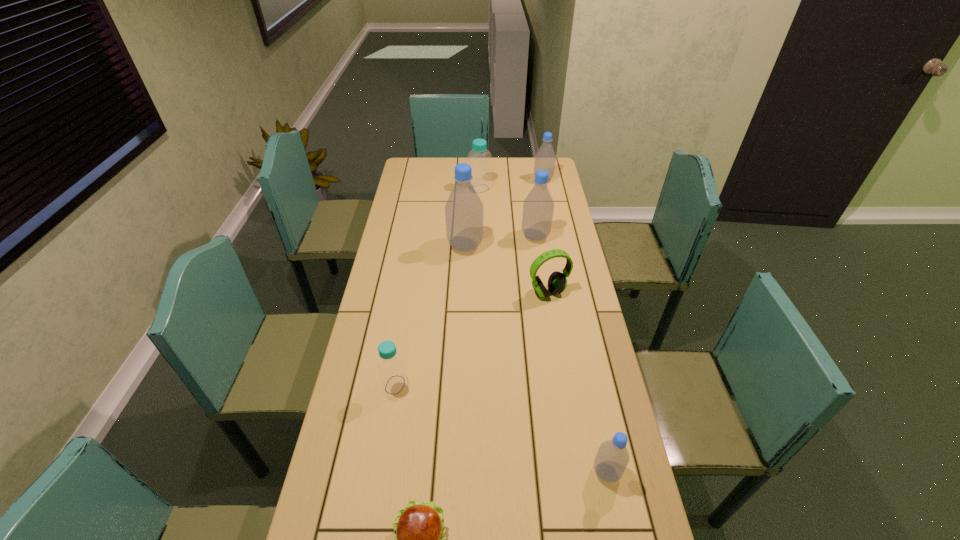
Locate an element on the screen. This screenshot has width=960, height=540. the nearest gray bottle is located at coordinates (612, 458).

This screenshot has height=540, width=960. In order to click on the fifth farthest bottle in this screenshot , I will do point(393,377).

The image size is (960, 540). I want to click on the leftmost object, so click(393, 377).

Where is `free location located 0.390m on the back of the leftmost gray bottle`? The height and width of the screenshot is (540, 960). free location located 0.390m on the back of the leftmost gray bottle is located at coordinates (468, 185).

Find the location of a particular element. The width and height of the screenshot is (960, 540). vacant space located on the right of the seventh shortest object is located at coordinates (564, 237).

At what (x,y) coordinates should I click in order to perform the action: click on blank space located on the left of the farther blue bottle. Please return your answer as a coordinate pair (x, y). Looking at the image, I should click on (404, 188).

Locate an element on the screen. The height and width of the screenshot is (540, 960). free region located on the front of the farthest gray bottle is located at coordinates (546, 195).

Where is `vacant area located on the left of the headset`? This screenshot has height=540, width=960. vacant area located on the left of the headset is located at coordinates (418, 293).

I want to click on vacant space located on the left of the nearest bottle, so click(x=572, y=472).

Locate an element on the screen. The image size is (960, 540). free region located on the back of the left blue bottle is located at coordinates (408, 303).